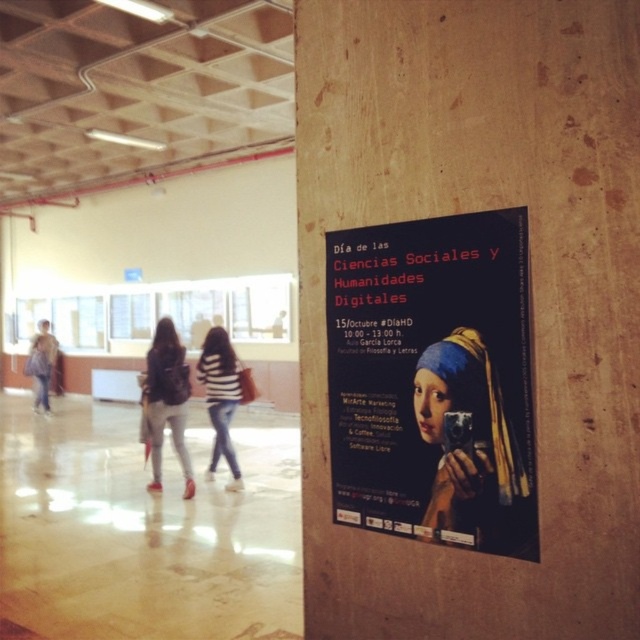
You are an observer in the hallway and see both the light brown fabric pants at center and the striped fabric sweater at center. Which object is taller?

The light brown fabric pants at center is taller than the striped fabric sweater at center according to the description.